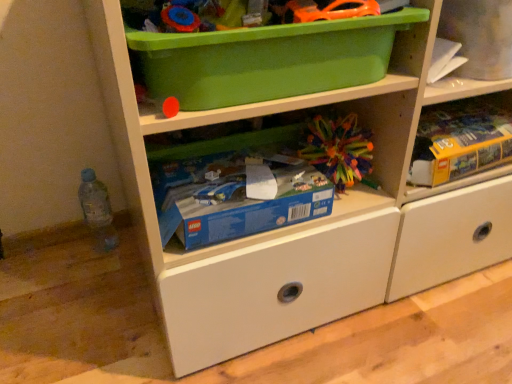
At what (x,y) coordinates should I click in order to perform the action: click on vacant space to the left of translucent plastic bottle at lower left. Please return your answer as a coordinate pair (x, y). Looking at the image, I should click on (52, 254).